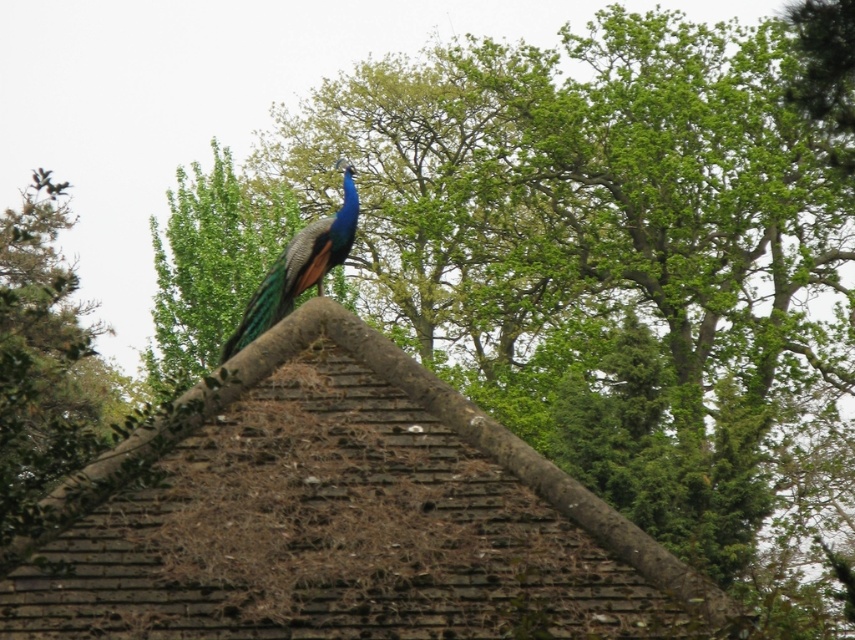
Does brown textured roof at upper center have a lesser width compared to shiny blue peacock at center?

No.

Who is positioned more to the right, brown textured roof at upper center or shiny blue peacock at center?

brown textured roof at upper center is more to the right.

Does point (603, 504) come in front of point (260, 314)?

Yes.

At what (x,y) coordinates should I click in order to perform the action: click on brown textured roof at upper center. Please return your answer as a coordinate pair (x, y). Image resolution: width=855 pixels, height=640 pixels. Looking at the image, I should click on (338, 516).

Does point (315, 589) come in front of point (178, 296)?

Yes, it is.

Does brown textured roof at upper center appear under green leafy tree at upper center?

Correct, brown textured roof at upper center is located below green leafy tree at upper center.

I want to click on brown textured roof at upper center, so click(338, 516).

Between green leafy tree at upper center and shiny blue peacock at center, which one has less height?

With less height is shiny blue peacock at center.

Does green leafy tree at upper center have a larger size compared to shiny blue peacock at center?

Yes.

Between point (155, 225) and point (263, 305), which one is positioned in front?

Point (263, 305) is in front.

Where is `green leafy tree at upper center`? This screenshot has height=640, width=855. green leafy tree at upper center is located at coordinates (210, 266).